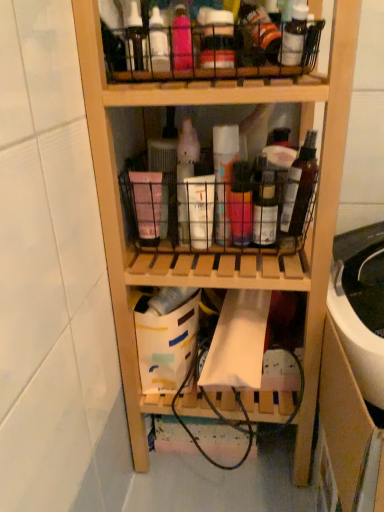
Question: Is white matte spray can at center, acting as the second bottle starting from the left, surrounding wooden drawer at lower right?

Choices:
 (A) yes
 (B) no

Answer: (B)

Question: Considering the relative sizes of white matte spray can at center, acting as the second bottle starting from the left, and wooden drawer at lower right in the image provided, is white matte spray can at center, acting as the second bottle starting from the left, taller than wooden drawer at lower right?

Choices:
 (A) no
 (B) yes

Answer: (A)

Question: Can you confirm if white matte spray can at center, acting as the second bottle starting from the left, is smaller than wooden drawer at lower right?

Choices:
 (A) no
 (B) yes

Answer: (B)

Question: From a real-world perspective, is white matte spray can at center, acting as the second bottle starting from the left, physically above wooden drawer at lower right?

Choices:
 (A) yes
 (B) no

Answer: (A)

Question: Is white matte spray can at center, acting as the second bottle starting from the left, bigger than wooden drawer at lower right?

Choices:
 (A) yes
 (B) no

Answer: (B)

Question: Is the position of white matte spray can at center, acting as the second bottle starting from the left, more distant than that of wooden drawer at lower right?

Choices:
 (A) no
 (B) yes

Answer: (B)

Question: From a real-world perspective, is wooden shelf at center, placed as the 1th shelf when sorted from bottom to top, below translucent plastic spray can at center, acting as the fourth bottle starting from the right?

Choices:
 (A) no
 (B) yes

Answer: (B)

Question: Does wooden shelf at center, which ranks as the second shelf in top-to-bottom order, have a greater width compared to translucent plastic spray can at center, acting as the fourth bottle starting from the right?

Choices:
 (A) no
 (B) yes

Answer: (B)

Question: Can you confirm if wooden shelf at center, which ranks as the second shelf in top-to-bottom order, is smaller than translucent plastic spray can at center, which is the first bottle in left-to-right order?

Choices:
 (A) no
 (B) yes

Answer: (A)

Question: Can you confirm if wooden shelf at center, placed as the 1th shelf when sorted from bottom to top, is positioned to the right of translucent plastic spray can at center, acting as the fourth bottle starting from the right?

Choices:
 (A) yes
 (B) no

Answer: (A)

Question: Is wooden shelf at center, which ranks as the second shelf in top-to-bottom order, in front of translucent plastic spray can at center, acting as the fourth bottle starting from the right?

Choices:
 (A) no
 (B) yes

Answer: (B)

Question: Considering the relative sizes of wooden shelf at center, placed as the 1th shelf when sorted from bottom to top, and translucent plastic spray can at center, which is the first bottle in left-to-right order, in the image provided, is wooden shelf at center, placed as the 1th shelf when sorted from bottom to top, bigger than translucent plastic spray can at center, which is the first bottle in left-to-right order,?

Choices:
 (A) yes
 (B) no

Answer: (A)

Question: From a real-world perspective, is translucent plastic spray can at center, acting as the fourth bottle starting from the right, located beneath pink matte basket at center?

Choices:
 (A) yes
 (B) no

Answer: (B)